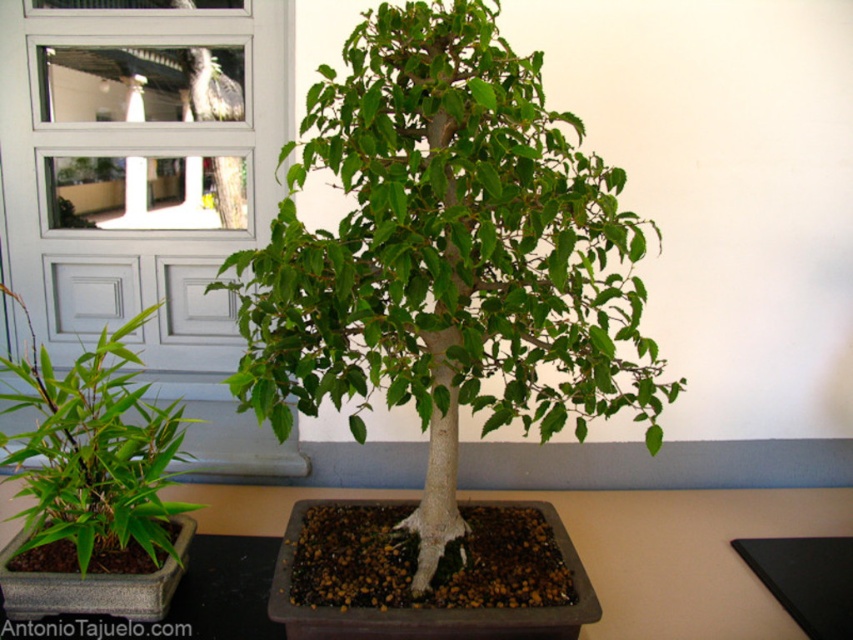
You are arranging a new potted plant between the green matte bonsai tree at center and the brown matte table at center. Which side should you place it on to ensure it is between them?

The green matte bonsai tree at center is to the left of the brown matte table at center, so placing the new potted plant to the right of the bonsai tree and to the left of the table would position it between them.

You are arranging a shelf in a store and need to place the green matte bonsai tree at center and the brown matte table at center next to each other. Based on their sizes, which object should be placed on the left side to ensure they fit properly?

The green matte bonsai tree at center has a smaller width than the brown matte table at center, so placing the bonsai tree on the left side would allow the table to fit properly next to it.

You have a small decorative statue that is 10 inches wide. You want to place it between the green matte bonsai tree at center and the brown matte table at center. Will there be enough space for the statue to fit between them?

The distance between the green matte bonsai tree at center and the brown matte table at center is 20.74 inches. Since the statue is only 10 inches wide, there is enough space to place it between them.